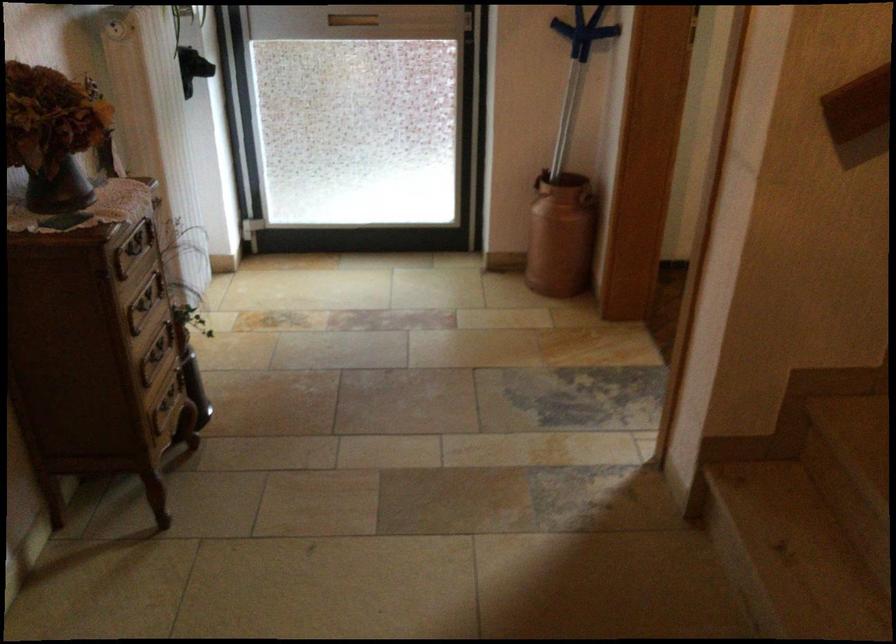
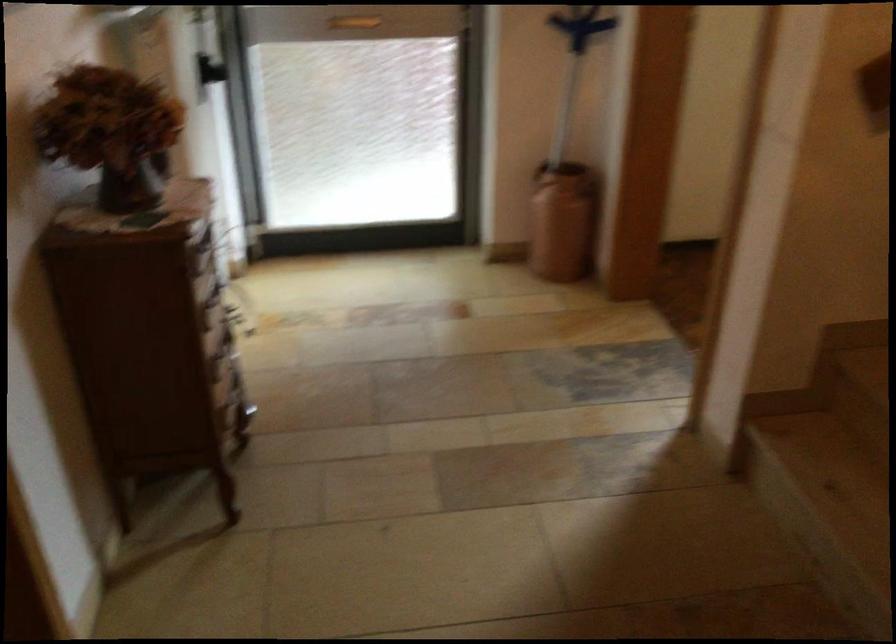
Question: In a continuous first-person perspective shot, in which direction is the camera moving?

Choices:
 (A) Left
 (B) Right
 (C) Forward
 (D) Backward

Answer: (A)